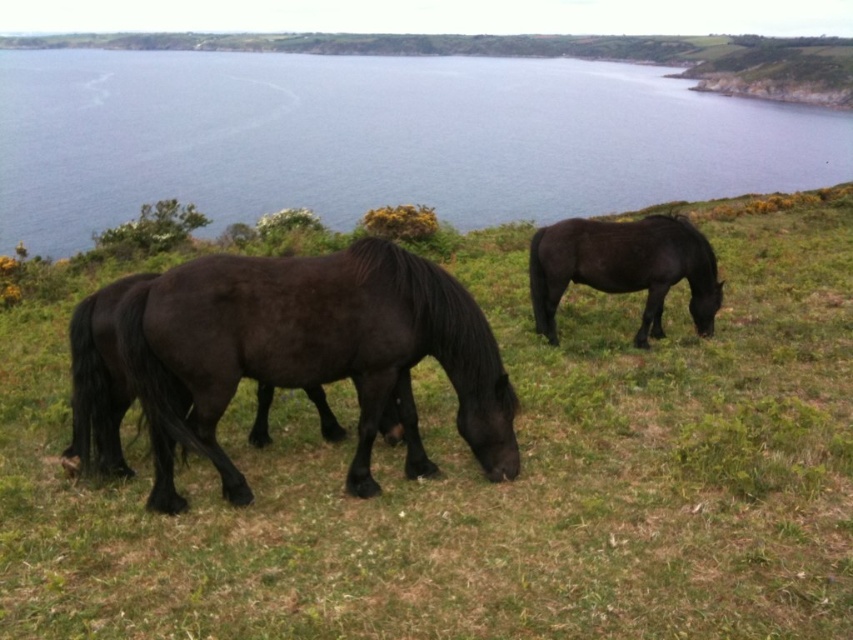
You are a photographer planning to capture a landscape shot of the coastal area. You have a camera with a 24mm lens that can capture a maximum width of 10 meters. The green grass at center and blue water at upper center are both in your frame. Can you determine which of these two elements will fit entirely within your camera lens based on their widths?

The green grass at center has a width less than the blue water at upper center. Since the camera lens can capture up to 10 meters, both elements might fit, but the green grass at center is narrower and will definitely fit entirely within the lens. The blue water at upper center is wider, so it may or may not fit depending on its exact width.

You are a photographer trying to capture a landscape photo that includes both the blue water at upper center and the shiny black horse at center. Since you want both elements to be clearly visible in the frame, which object should you prioritize framing first to ensure it fits properly?

The blue water at upper center has a larger width than the shiny black horse at center, so you should prioritize framing the blue water at upper center first to ensure it fits properly in the photo.

You are a photographer standing at the bottom of the hill. You want to take a photo of the shiny black horse at center without any green grass at center in the foreground. Is this possible?

The green grass at center is positioned over the shiny black horse at center, so if you are standing at the bottom of the hill, you would see the green grass at center in front of the shiny black horse at center. Therefore, it is not possible to take a photo of the shiny black horse at center without the green grass at center in the foreground.